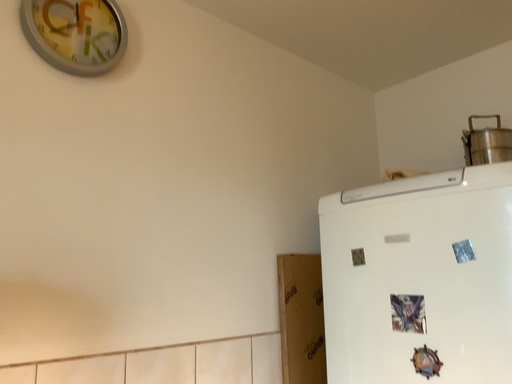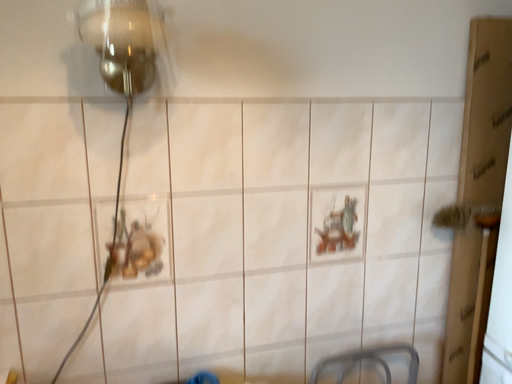
Question: Which way did the camera rotate in the video?

Choices:
 (A) rotated downward
 (B) rotated upward

Answer: (A)